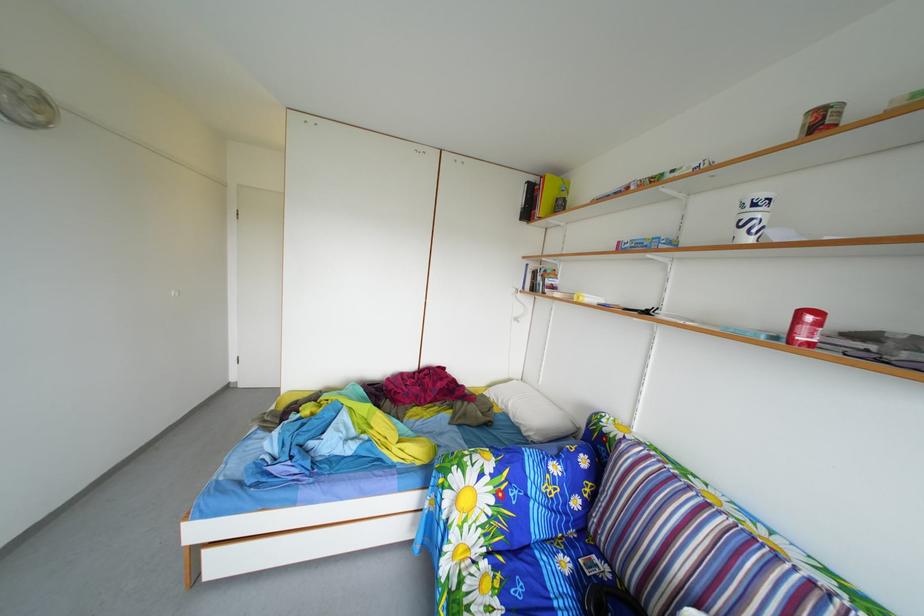
The image size is (924, 616). What do you see at coordinates (528, 201) in the screenshot?
I see `a black binder` at bounding box center [528, 201].